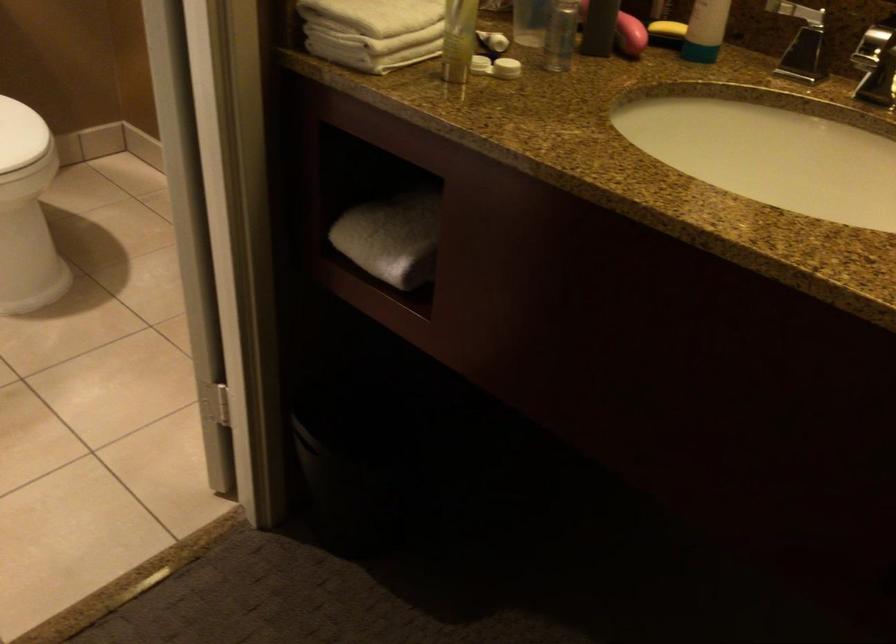
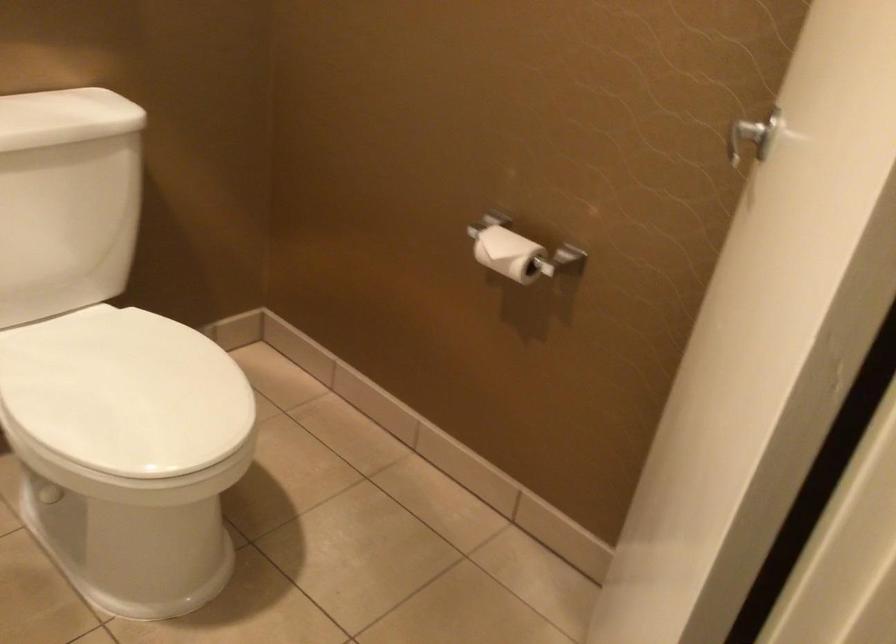
Question: How did the camera likely rotate?

Choices:
 (A) Left
 (B) Right
 (C) Up
 (D) Down

Answer: (C)